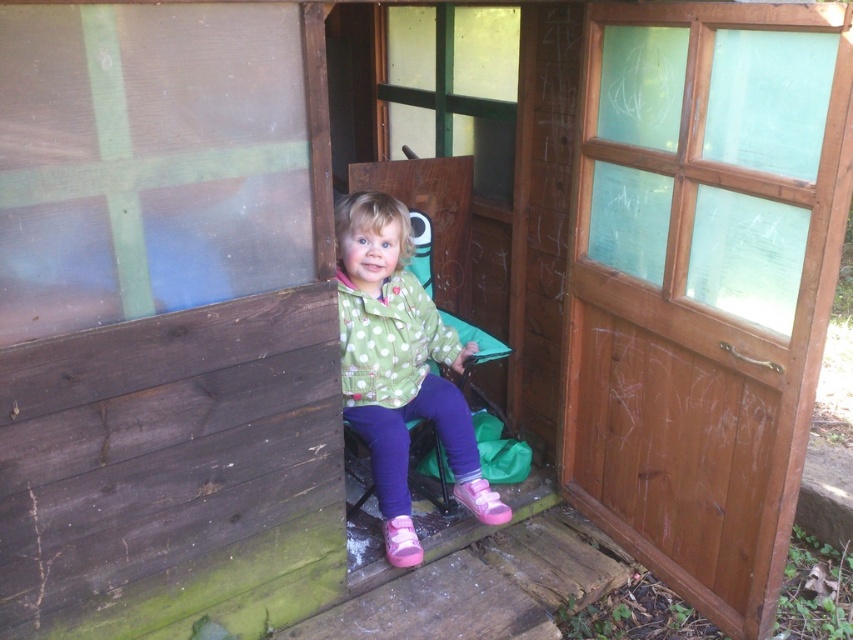
Question: Which point is closer to the camera taking this photo?

Choices:
 (A) (573, 352)
 (B) (468, 353)

Answer: (B)

Question: Where is wooden screen door at center located in relation to green polka dot jacket at center in the image?

Choices:
 (A) above
 (B) below

Answer: (A)

Question: Can you confirm if wooden screen door at center is bigger than green polka dot jacket at center?

Choices:
 (A) yes
 (B) no

Answer: (A)

Question: Which point is closer to the camera?

Choices:
 (A) (787, 106)
 (B) (389, 563)

Answer: (A)

Question: Which point is closer to the camera?

Choices:
 (A) wooden screen door at center
 (B) green polka dot jacket at center

Answer: (A)

Question: Can you confirm if wooden screen door at center is positioned to the left of green polka dot jacket at center?

Choices:
 (A) no
 (B) yes

Answer: (A)